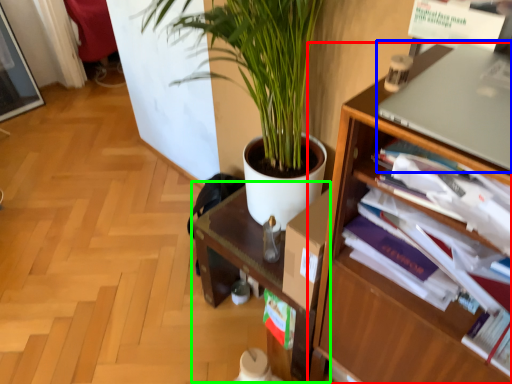
Question: Estimate the real-world distances between objects in this image. Which object is farther from shelf (highlighted by a red box), computer (highlighted by a blue box) or computer desk (highlighted by a green box)?

Choices:
 (A) computer
 (B) computer desk

Answer: (B)